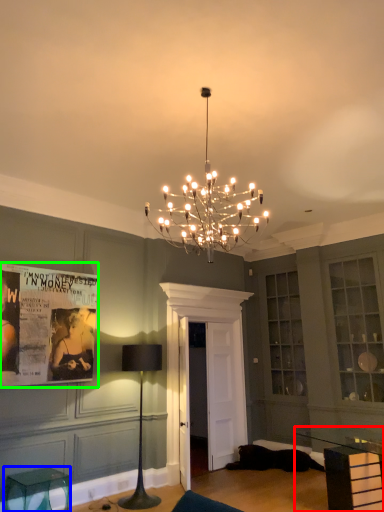
Question: Which object is the farthest from table (highlighted by a red box)? Choose among these: furniture (highlighted by a blue box) or poster page (highlighted by a green box).

Choices:
 (A) furniture
 (B) poster page

Answer: (B)